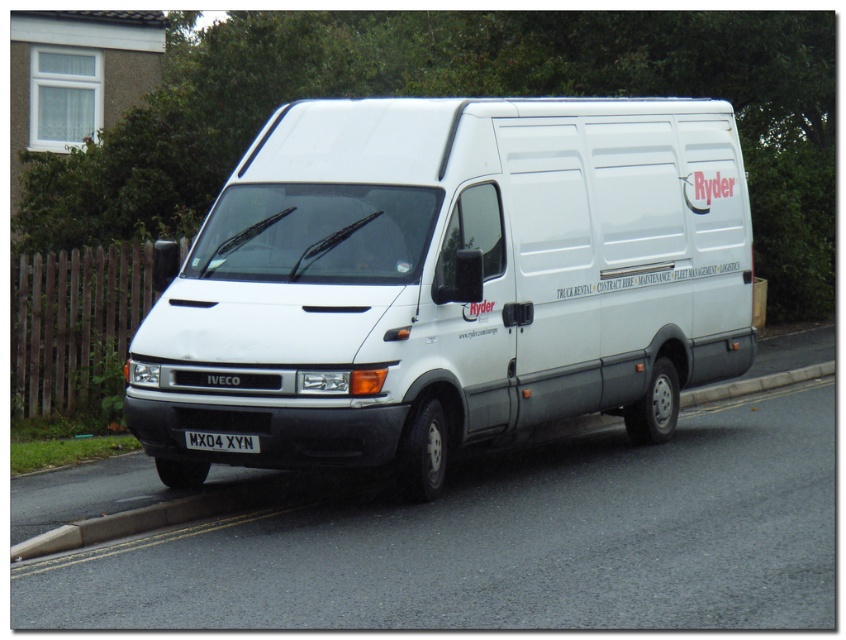
In the scene shown: You are a delivery driver who needs to park your white matte van at center as close as possible to the concrete curb at lower center without crossing the curb. Based on the scene, is the van currently positioned to the left or right of the curb?

The white matte van at center is to the left of the concrete curb at lower center, so it is positioned correctly to the left without crossing the curb.

You are a delivery driver who needs to park your van as close as possible to the curb. Given the size difference between the concrete curb at lower center and the white plastic license plate at center, which object should you align your van with to ensure proper parking?

The concrete curb at lower center has a larger size compared to the white plastic license plate at center, so you should align your van with the concrete curb at lower center to ensure proper parking.